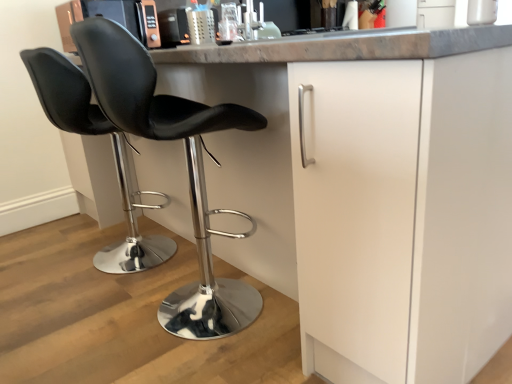
Question: In the image, is black leather chair at center, arranged as the first chair when viewed from the left, positioned in front of or behind black leather stool at center, positioned as the 2th chair in left-to-right order?

Choices:
 (A) behind
 (B) front

Answer: (A)

Question: In terms of height, does black leather chair at center, the 2th chair when ordered from right to left, look taller or shorter compared to black leather stool at center, positioned as the 2th chair in left-to-right order?

Choices:
 (A) short
 (B) tall

Answer: (A)

Question: Based on their positions, is black leather chair at center, the 2th chair when ordered from right to left, located to the left or right of black leather stool at center, positioned as the 2th chair in left-to-right order?

Choices:
 (A) left
 (B) right

Answer: (A)

Question: Considering their positions, is black leather stool at center, which appears as the 1th chair when viewed from the right, located in front of or behind black leather chair at center, the 2th chair when ordered from right to left?

Choices:
 (A) behind
 (B) front

Answer: (B)

Question: From their relative heights in the image, would you say black leather stool at center, which appears as the 1th chair when viewed from the right, is taller or shorter than black leather chair at center, arranged as the first chair when viewed from the left?

Choices:
 (A) tall
 (B) short

Answer: (A)

Question: Is point [212, 286] positioned closer to the camera than point [80, 92]?

Choices:
 (A) closer
 (B) farther

Answer: (B)

Question: From the image's perspective, is black leather stool at center, which appears as the 1th chair when viewed from the right, located above or below black leather chair at center, arranged as the first chair when viewed from the left?

Choices:
 (A) above
 (B) below

Answer: (B)